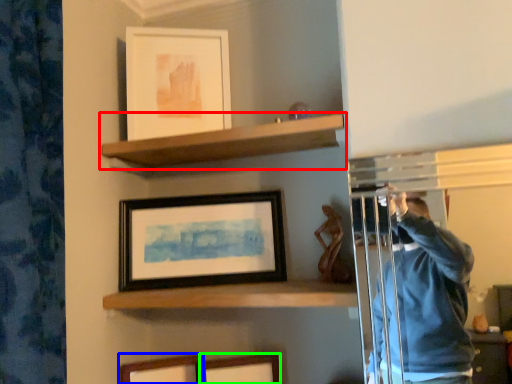
Question: Which object is positioned farthest from shelf (highlighted by a red box)? Select from picture frame (highlighted by a blue box) and picture frame (highlighted by a green box).

Choices:
 (A) picture frame
 (B) picture frame

Answer: (A)